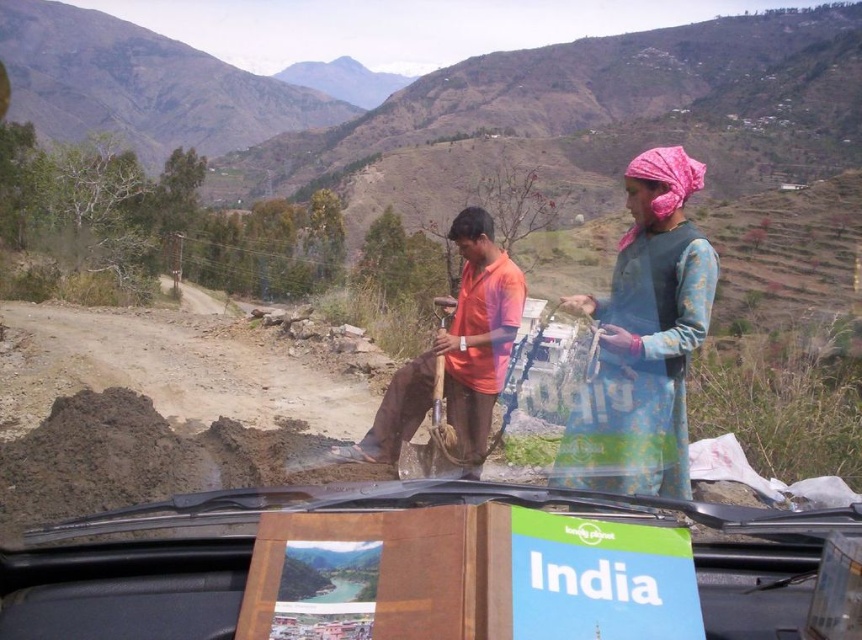
You are a photographer trying to capture a photo of the blue printed dress at right and the brown clay at lower left. Which object should you zoom in on to make it appear larger in the photo?

The brown clay at lower left is thicker than the blue printed dress at right, so you should zoom in on the brown clay at lower left to make it appear larger in the photo.

From the picture: You are a photographer trying to capture both the blue printed dress at right and the brown clay at lower left in a single frame. Since you can only focus on one object at a time, which object should you choose to ensure the other remains visible in the background?

You should focus on the blue printed dress at right because it is larger in size than the brown clay at lower left, making it easier to keep the smaller brown clay at lower left in the background while maintaining visibility.